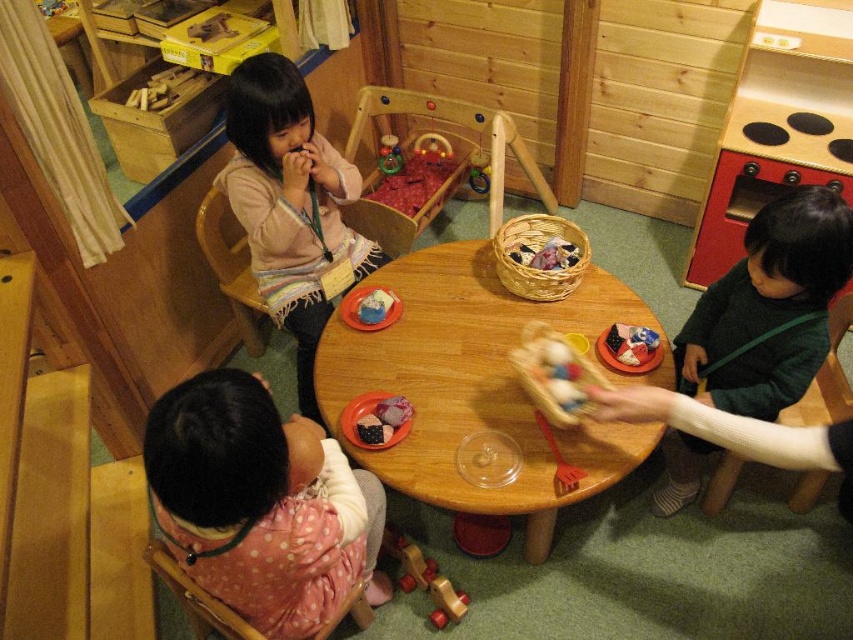
Question: Which object is farther from the camera taking this photo?

Choices:
 (A) wooden toy at center
 (B) matte pink sweater at upper left
 (C) wooden toy basket at center

Answer: (A)

Question: Among these objects, which one is nearest to the camera?

Choices:
 (A) blue fabric cloth at table center
 (B) soft fabric basket at center

Answer: (B)

Question: Among these objects, which one is nearest to the camera?

Choices:
 (A) blue fabric cloth at table center
 (B) wooden toy at center
 (C) wooden table at center

Answer: (C)

Question: Is matte pink sweater at upper left positioned in front of wooden toy basket at center?

Choices:
 (A) no
 (B) yes

Answer: (A)

Question: Does pink polka dot dress at lower left have a larger size compared to smooth matte fabric at table center?

Choices:
 (A) no
 (B) yes

Answer: (B)

Question: Can you confirm if wooden table at center is smaller than soft fabric basket at center?

Choices:
 (A) no
 (B) yes

Answer: (A)